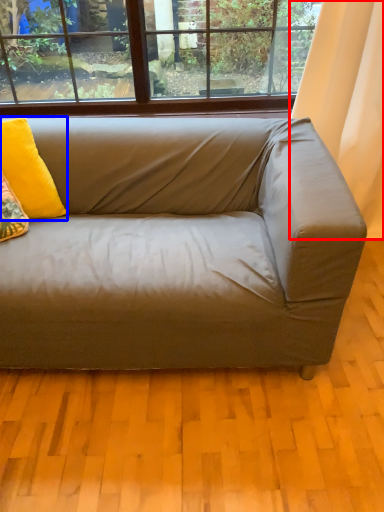
Question: Which point is closer to the camera, curtain (highlighted by a red box) or pillow (highlighted by a blue box)?

Choices:
 (A) curtain
 (B) pillow

Answer: (B)